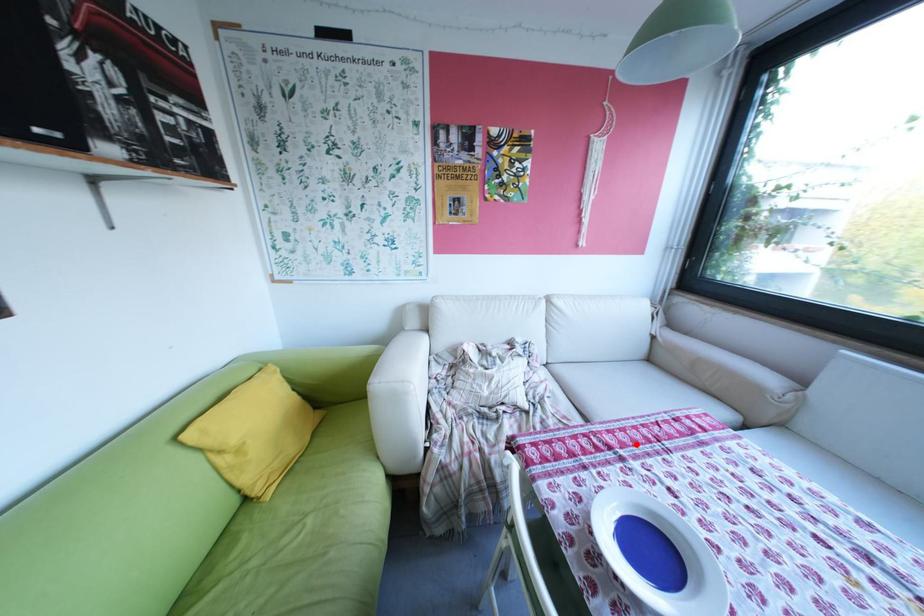
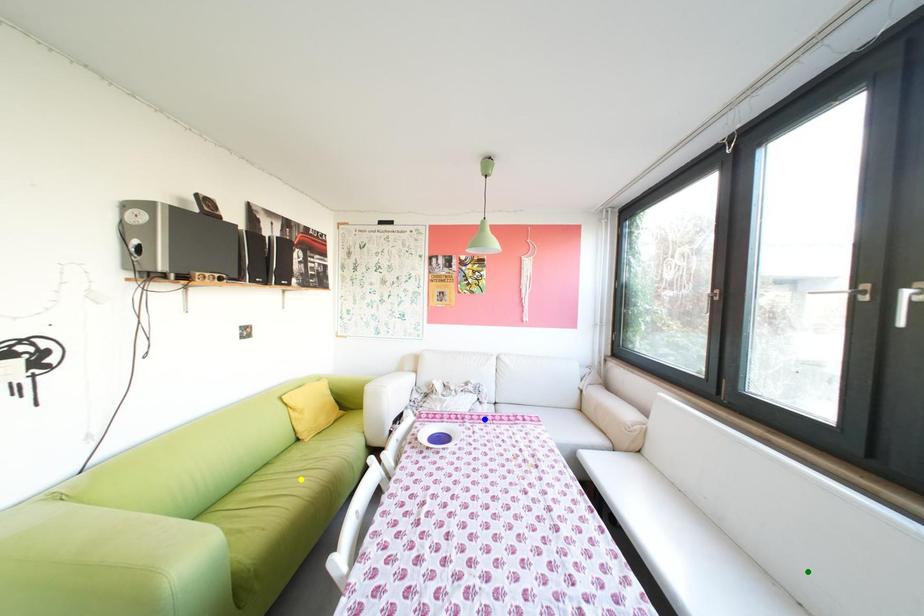
Question: I am providing you with two images of the same scene from different viewpoints. A red point is marked on the first image. You are given multiple points on the second image. Which mark in image 2 goes with the point in image 1?

Choices:
 (A) blue point
 (B) green point
 (C) yellow point

Answer: (A)